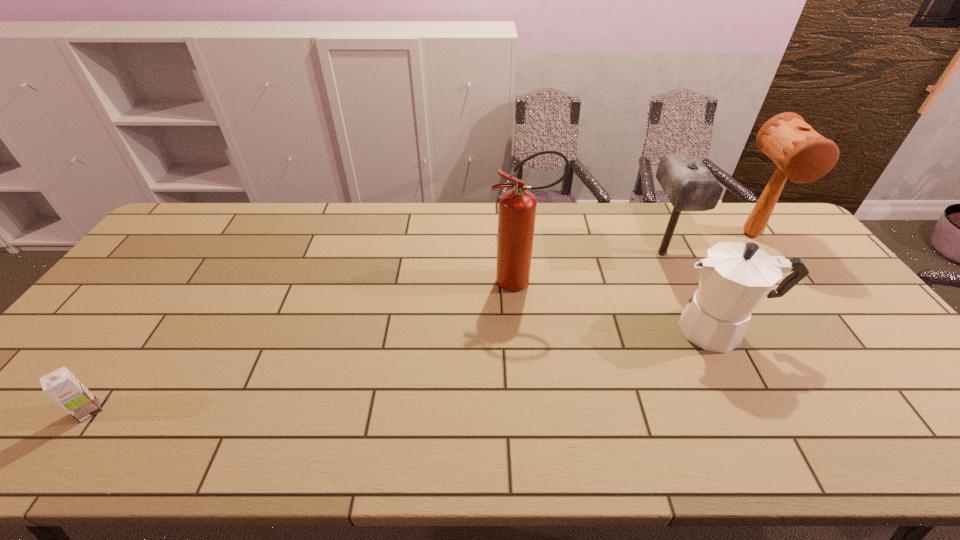
Find the location of a particular element. the fourth object from right to left is located at coordinates (517, 207).

The height and width of the screenshot is (540, 960). Identify the location of the rightmost object. (802, 155).

In order to click on the left mallet in this screenshot , I will do `click(689, 185)`.

At what (x,y) coordinates should I click in order to perform the action: click on coffeepot. Please return your answer as a coordinate pair (x, y). This screenshot has height=540, width=960. Looking at the image, I should click on (735, 278).

Locate an element on the screen. the fourth tallest object is located at coordinates (735, 278).

At what (x,y) coordinates should I click in order to perform the action: click on the shortest object. Please return your answer as a coordinate pair (x, y). This screenshot has height=540, width=960. Looking at the image, I should click on (61, 385).

At what (x,y) coordinates should I click in order to perform the action: click on chocolate milk. Please return your answer as a coordinate pair (x, y). This screenshot has width=960, height=540. Looking at the image, I should click on (61, 385).

Find the location of a particular element. This screenshot has width=960, height=540. free space located 0.070m from the nozzle of the second object from left to right is located at coordinates (467, 281).

Image resolution: width=960 pixels, height=540 pixels. I want to click on vacant space positioned 0.050m from the nozzle of the second object from left to right, so click(x=473, y=281).

You are a GUI agent. You are given a task and a screenshot of the screen. Output one action in this format:
    pyautogui.click(x=<x>, y=<y>)
    Task: Click on the blank area located from the nozzle of the second object from left to right
    
    Given the screenshot: What is the action you would take?
    pyautogui.click(x=356, y=281)